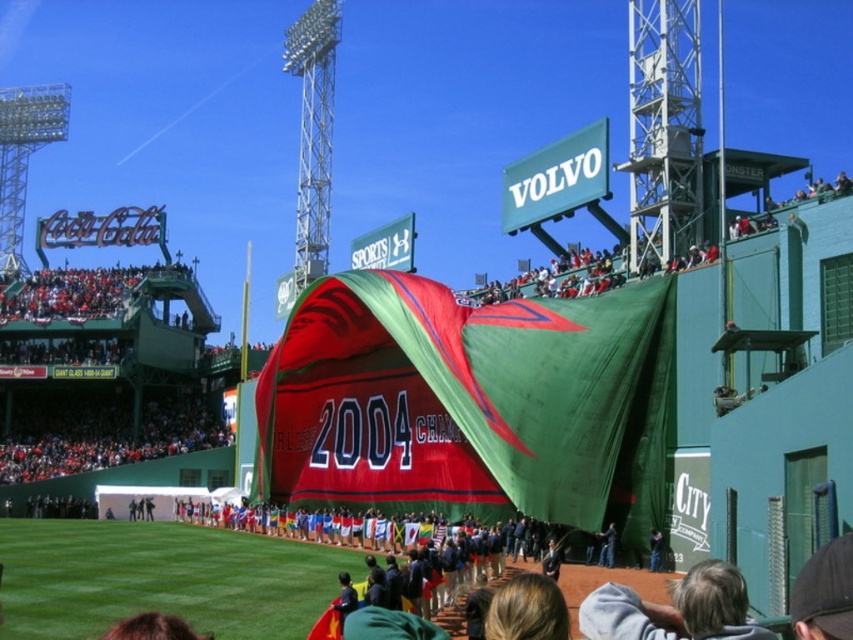
Describe the element at coordinates (607, 545) in the screenshot. I see `dark blue jeans at center` at that location.

Is point (605, 556) positioned behind point (656, 531)?

Yes, point (605, 556) is behind point (656, 531).

The width and height of the screenshot is (853, 640). I want to click on dark blue jeans at center, so click(x=607, y=545).